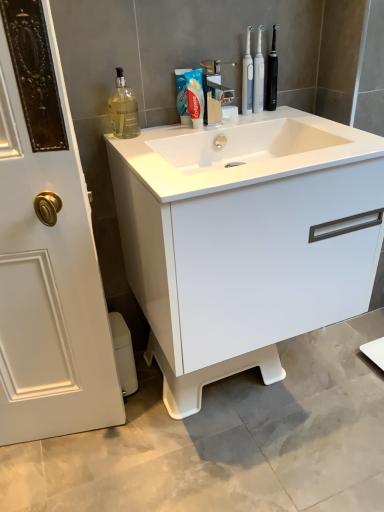
Question: Could you tell me if black plastic toothbrush at upper right, the 1th toiletry when ordered from right to left, is facing white plastic toilet bowl at lower left?

Choices:
 (A) yes
 (B) no

Answer: (B)

Question: Considering the relative positions of black plastic toothbrush at upper right, the 1th toiletry when ordered from right to left, and white plastic toilet bowl at lower left in the image provided, is black plastic toothbrush at upper right, the 1th toiletry when ordered from right to left, behind white plastic toilet bowl at lower left?

Choices:
 (A) no
 (B) yes

Answer: (A)

Question: From a real-world perspective, does black plastic toothbrush at upper right, the 1th toiletry when ordered from right to left, sit lower than white plastic toilet bowl at lower left?

Choices:
 (A) no
 (B) yes

Answer: (A)

Question: Considering the relative positions of black plastic toothbrush at upper right, placed as the 2th toiletry when sorted from left to right, and white plastic toilet bowl at lower left in the image provided, is black plastic toothbrush at upper right, placed as the 2th toiletry when sorted from left to right, to the left of white plastic toilet bowl at lower left from the viewer's perspective?

Choices:
 (A) yes
 (B) no

Answer: (B)

Question: Is black plastic toothbrush at upper right, the 1th toiletry when ordered from right to left, wider than white plastic toilet bowl at lower left?

Choices:
 (A) no
 (B) yes

Answer: (A)

Question: From the image's perspective, is white matte toothpaste at center positioned above or below translucent glass bottle at upper left?

Choices:
 (A) below
 (B) above

Answer: (B)

Question: From a real-world perspective, relative to translucent glass bottle at upper left, is white matte toothpaste at center vertically above or below?

Choices:
 (A) above
 (B) below

Answer: (B)

Question: Would you say white matte toothpaste at center is inside or outside translucent glass bottle at upper left?

Choices:
 (A) outside
 (B) inside

Answer: (A)

Question: Is white matte toothpaste at center taller or shorter than translucent glass bottle at upper left?

Choices:
 (A) tall
 (B) short

Answer: (B)

Question: Looking at their shapes, would you say white glossy sink at center is wider or thinner than white matte toothpaste at center?

Choices:
 (A) wide
 (B) thin

Answer: (A)

Question: From a real-world perspective, is white glossy sink at center positioned above or below white matte toothpaste at center?

Choices:
 (A) below
 (B) above

Answer: (A)

Question: In the image, is white glossy sink at center on the left side or the right side of white matte toothpaste at center?

Choices:
 (A) right
 (B) left

Answer: (A)

Question: Is point (112, 138) positioned closer to the camera than point (200, 84)?

Choices:
 (A) closer
 (B) farther

Answer: (A)

Question: In the image, is white glossy cabinet at center positioned in front of or behind white glossy sink at center?

Choices:
 (A) front
 (B) behind

Answer: (B)

Question: From the image's perspective, relative to white glossy sink at center, is white glossy cabinet at center above or below?

Choices:
 (A) above
 (B) below

Answer: (B)